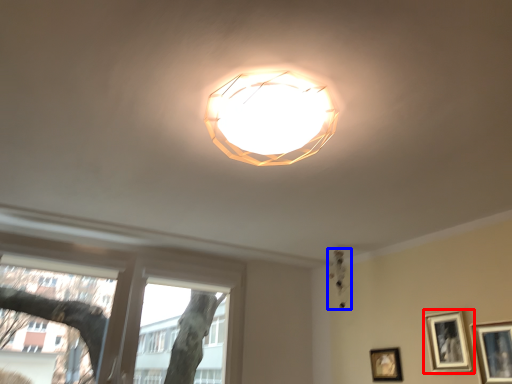
Question: Which point is closer to the camera, picture frame (highlighted by a red box) or lamp (highlighted by a blue box)?

Choices:
 (A) picture frame
 (B) lamp

Answer: (A)